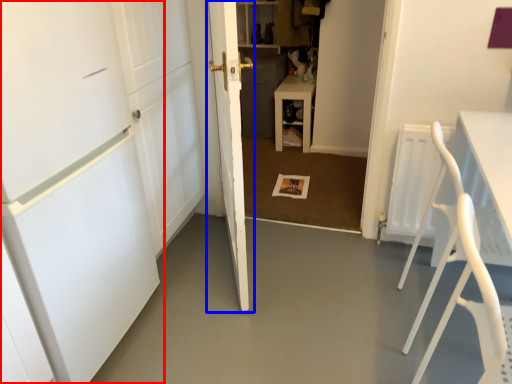
Question: Which point is closer to the camera, door (highlighted by a red box) or door (highlighted by a blue box)?

Choices:
 (A) door
 (B) door

Answer: (A)